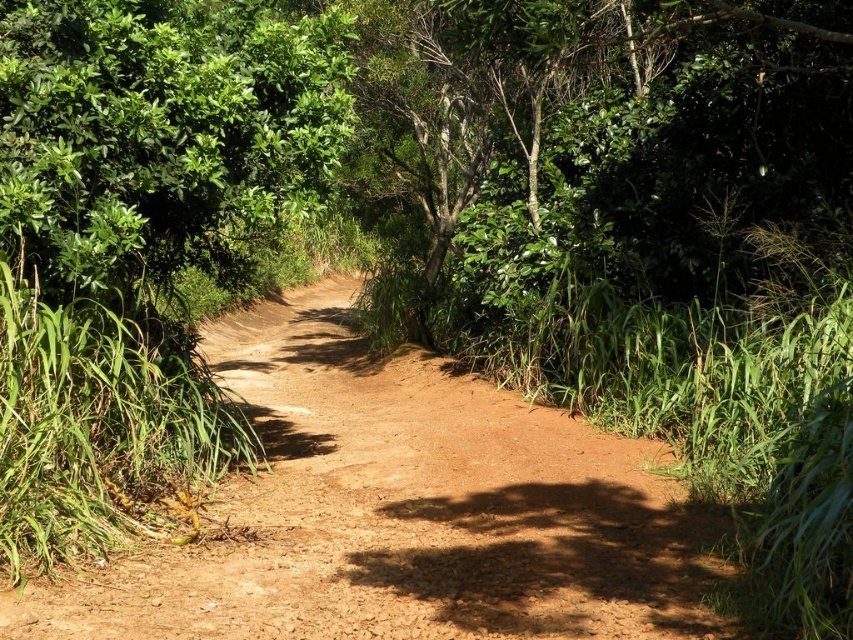
You are a hiker trying to navigate through the forest. You see the dusty brown dirt track at center and the green leafy tree at upper left. Which one is wider?

The dusty brown dirt track at center is wider than the green leafy tree at upper left because its width surpasses the tree.

You are a hiker standing on the dusty brown dirt track at center and want to take a photo of the green leafy tree at upper left. Which object is closer to the camera so that the tree appears larger in the photo?

The dusty brown dirt track at center is closer to the camera than the green leafy tree at upper left. Since the dusty brown dirt track at center has a lesser height compared to the green leafy tree at upper left, the tree would appear smaller in the photo unless you move closer.

You are a hiker who wants to take a photo of the dusty brown dirt track at center and the green leafy tree at upper left. Which object should you focus on first if you want to capture both in a single frame without moving the camera?

The dusty brown dirt track at center is bigger than the green leafy tree at upper left, so you should focus on the dusty brown dirt track at center first to ensure it fills the frame appropriately before adjusting for the smaller tree.